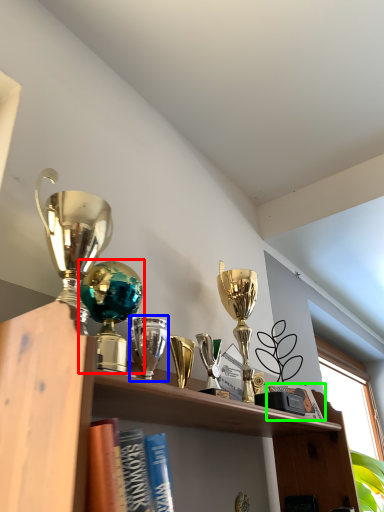
Question: Considering the real-world distances, which object is closest to trophy (highlighted by a red box)? trophy (highlighted by a blue box) or book (highlighted by a green box).

Choices:
 (A) trophy
 (B) book

Answer: (A)